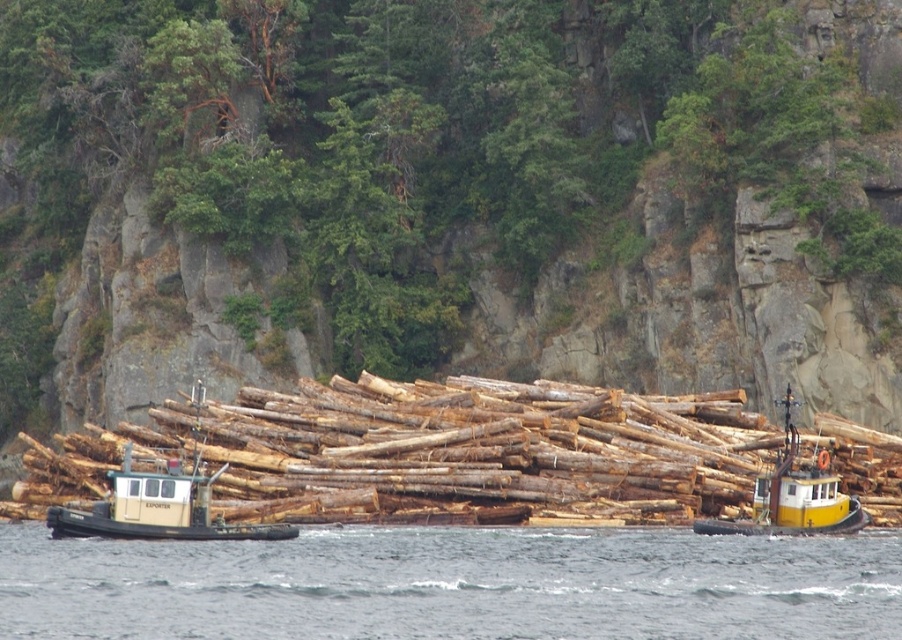
Who is positioned more to the right, green leafy tree at center or clear water at center?

clear water at center is more to the right.

Does green leafy tree at center appear on the right side of clear water at center?

No, green leafy tree at center is not to the right of clear water at center.

Is point (449, 168) behind point (889, 621)?

That is True.

What are the coordinates of `green leafy tree at center` in the screenshot? It's located at (449, 195).

Does clear water at center come in front of yellow matte tugboat at center?

Yes, clear water at center is closer to the viewer.

Does clear water at center have a smaller size compared to yellow matte tugboat at center?

Incorrect, clear water at center is not smaller in size than yellow matte tugboat at center.

At what (x,y) coordinates should I click in order to perform the action: click on clear water at center. Please return your answer as a coordinate pair (x, y). Image resolution: width=902 pixels, height=640 pixels. Looking at the image, I should click on (452, 586).

Who is positioned more to the left, clear water at center or beige rubber tugboat at left?

beige rubber tugboat at left is more to the left.

Can you confirm if clear water at center is thinner than beige rubber tugboat at left?

Incorrect, clear water at center's width is not less than beige rubber tugboat at left's.

The width and height of the screenshot is (902, 640). What do you see at coordinates (452, 586) in the screenshot?
I see `clear water at center` at bounding box center [452, 586].

Where is `clear water at center`? The image size is (902, 640). clear water at center is located at coordinates (452, 586).